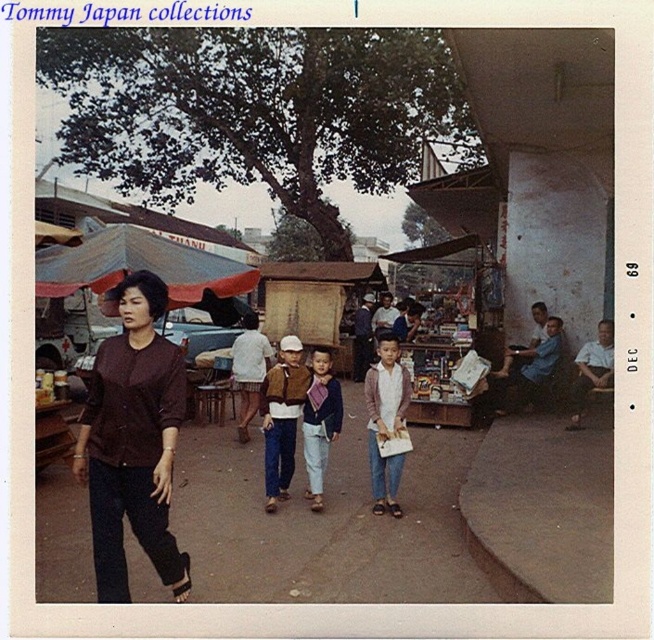
Looking at the image, there is a point marked at coordinates (x=133, y=442). What object is located at that point?

The point at (x=133, y=442) marks the brown fabric shirt at center.

You are standing in the market and see the brown fabric shirt at center. Can you tell me its exact 2D coordinates in the image?

The 2D coordinates of the brown fabric shirt at center are at point (133, 442).